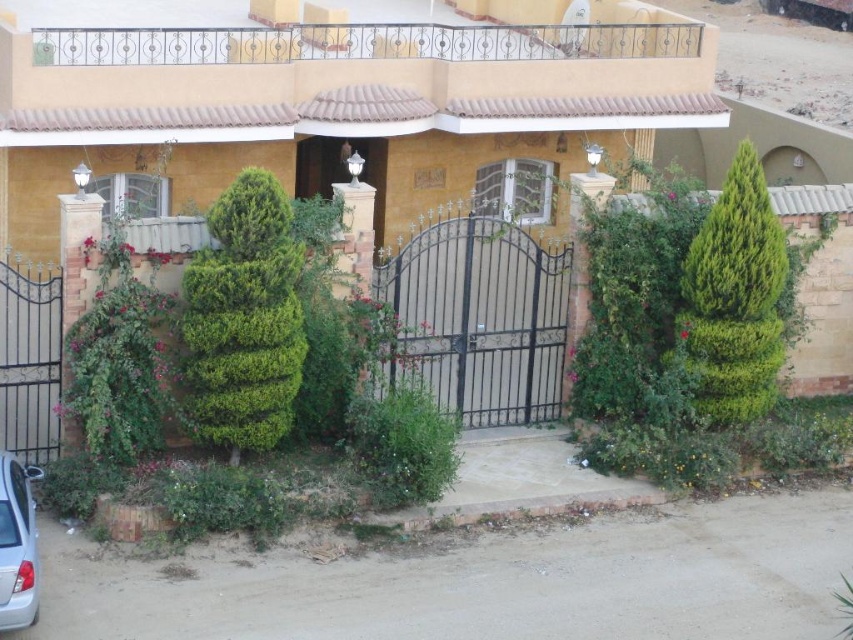
You are a delivery person approaching the entrance of the house. You need to park your white glossy car at lower left near the green leafy hedge at center. Can you park the car in front of the hedge without blocking the gate?

The green leafy hedge at center is located above the white glossy car at lower left, so the car can be parked in front of the hedge without blocking the gate as the hedge is positioned higher up relative to the car.

You are standing at the entrance of the house and want to walk through the gate. There are two green plants in front of you. Which one is closer to the gate? The green leafy hedge at center or the green textured bush at right?

The green leafy hedge at center is positioned on the left side of green textured bush at right, so the green leafy hedge at center is closer to the gate.

You are a delivery person approaching the house and need to park your white glossy car at lower left. The driveway is narrow. Can you park the car without hitting the green textured bush at right?

The green textured bush at right is much taller than the white glossy car at lower left. Since the bush is taller, it might not block the height of the car, but the description does not provide information about the width or distance between them. Therefore, it is uncertain if the car can park without hitting the bush.